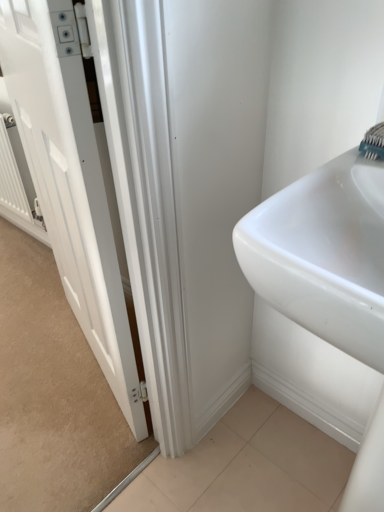
Question: Is white metallic radiator at left surrounding white glossy door at left?

Choices:
 (A) yes
 (B) no

Answer: (B)

Question: From a real-world perspective, is white metallic radiator at left physically below white glossy door at left?

Choices:
 (A) no
 (B) yes

Answer: (B)

Question: Can you confirm if white metallic radiator at left is bigger than white glossy door at left?

Choices:
 (A) yes
 (B) no

Answer: (B)

Question: Is white metallic radiator at left not within white glossy door at left?

Choices:
 (A) yes
 (B) no

Answer: (A)

Question: Does white metallic radiator at left lie in front of white glossy door at left?

Choices:
 (A) yes
 (B) no

Answer: (B)

Question: Considering the positions of point (1, 130) and point (377, 133), is point (1, 130) closer or farther from the camera than point (377, 133)?

Choices:
 (A) closer
 (B) farther

Answer: (B)

Question: In terms of height, does white metallic radiator at left look taller or shorter compared to teal plastic toothbrush at upper right?

Choices:
 (A) tall
 (B) short

Answer: (A)

Question: Is white metallic radiator at left situated inside teal plastic toothbrush at upper right or outside?

Choices:
 (A) inside
 (B) outside

Answer: (B)

Question: From a real-world perspective, is white metallic radiator at left positioned above or below teal plastic toothbrush at upper right?

Choices:
 (A) below
 (B) above

Answer: (A)

Question: In terms of height, does teal plastic toothbrush at upper right look taller or shorter compared to white glossy door at left?

Choices:
 (A) short
 (B) tall

Answer: (A)

Question: From the image's perspective, relative to white glossy door at left, is teal plastic toothbrush at upper right above or below?

Choices:
 (A) below
 (B) above

Answer: (B)

Question: From a real-world perspective, is teal plastic toothbrush at upper right physically located above or below white glossy door at left?

Choices:
 (A) above
 (B) below

Answer: (A)

Question: In terms of size, does teal plastic toothbrush at upper right appear bigger or smaller than white glossy door at left?

Choices:
 (A) small
 (B) big

Answer: (A)

Question: Relative to white metallic radiator at left, is white glossy door at left in front or behind?

Choices:
 (A) front
 (B) behind

Answer: (A)

Question: Is white glossy door at left to the left or to the right of white metallic radiator at left in the image?

Choices:
 (A) right
 (B) left

Answer: (A)